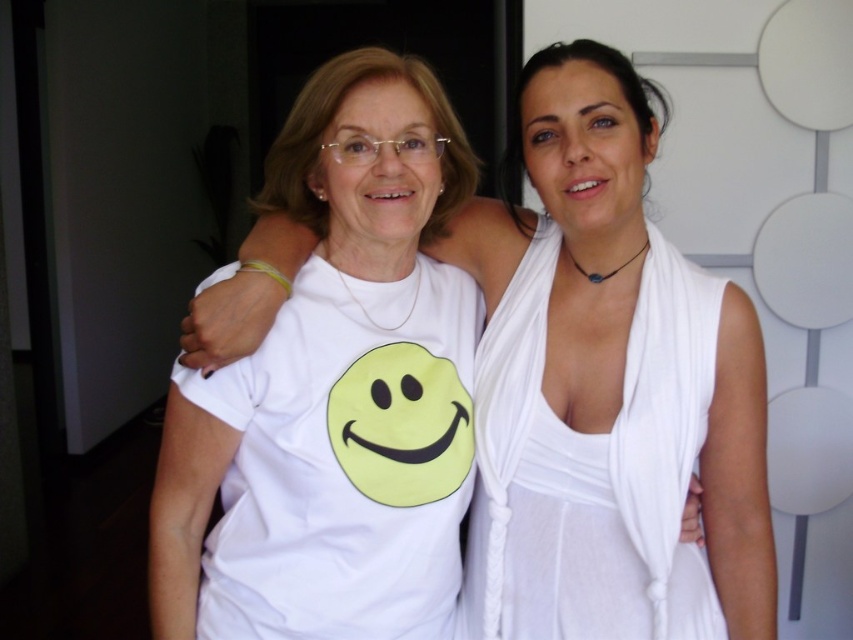
Question: Which point appears farthest from the camera in this image?

Choices:
 (A) (410, 140)
 (B) (721, 292)
 (C) (535, 605)

Answer: (C)

Question: Can you confirm if white fabric dress at center is thinner than smooth skin face at center?

Choices:
 (A) no
 (B) yes

Answer: (A)

Question: Estimate the real-world distances between objects in this image. Which object is closer to the smooth skin face at center?

Choices:
 (A) matte white face at center
 (B) white silky dress at center

Answer: (A)

Question: Is white fabric dress at center positioned in front of smooth skin face at center?

Choices:
 (A) yes
 (B) no

Answer: (B)

Question: Is white fabric dress at center above smooth skin face at center?

Choices:
 (A) yes
 (B) no

Answer: (B)

Question: Considering the real-world distances, which object is farthest from the white fabric dress at center?

Choices:
 (A) white silky dress at center
 (B) matte white face at center
 (C) smooth skin face at center

Answer: (B)